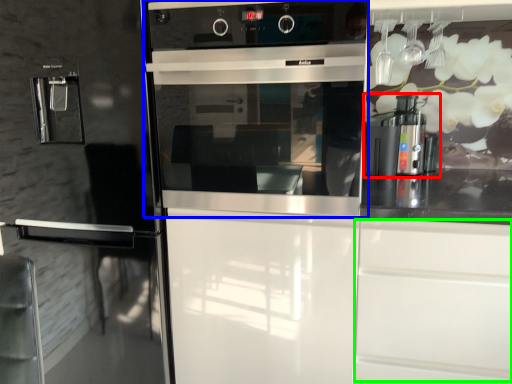
Question: Which object is positioned closest to coffee machine (highlighted by a red box)? Select from home appliance (highlighted by a blue box) and drawer (highlighted by a green box).

Choices:
 (A) home appliance
 (B) drawer

Answer: (B)